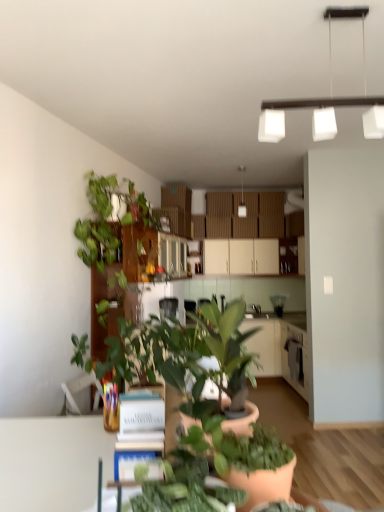
Question: Is green matte plant at center, which is the 2th houseplant from front to back, directly adjacent to white matte cabinet at center?

Choices:
 (A) yes
 (B) no

Answer: (B)

Question: Is green matte plant at center, which is the 2th houseplant from front to back, outside white matte cabinet at center?

Choices:
 (A) no
 (B) yes

Answer: (B)

Question: Considering the relative positions of green matte plant at center, arranged as the second houseplant when viewed from the back, and white matte cabinet at center in the image provided, is green matte plant at center, arranged as the second houseplant when viewed from the back, in front of white matte cabinet at center?

Choices:
 (A) no
 (B) yes

Answer: (B)

Question: From a real-world perspective, is green matte plant at center, which ranks as the second houseplant in left-to-right order, physically above white matte cabinet at center?

Choices:
 (A) yes
 (B) no

Answer: (B)

Question: Considering the relative sizes of green matte plant at center, which ranks as the second houseplant in left-to-right order, and white matte cabinet at center in the image provided, is green matte plant at center, which ranks as the second houseplant in left-to-right order, shorter than white matte cabinet at center?

Choices:
 (A) yes
 (B) no

Answer: (A)

Question: Can you confirm if green matte plant at center, arranged as the second houseplant when viewed from the back, is smaller than white matte cabinet at center?

Choices:
 (A) no
 (B) yes

Answer: (B)

Question: Is white matte book at center at the right side of green matte plant at center, positioned as the 3th houseplant in left-to-right order?

Choices:
 (A) no
 (B) yes

Answer: (A)

Question: Does white matte book at center contain green matte plant at center, positioned as the 3th houseplant in left-to-right order?

Choices:
 (A) no
 (B) yes

Answer: (A)

Question: Does white matte book at center have a greater width compared to green matte plant at center, the 3th houseplant when ordered from back to front?

Choices:
 (A) yes
 (B) no

Answer: (A)

Question: Does white matte book at center have a larger size compared to green matte plant at center, positioned as the 3th houseplant in left-to-right order?

Choices:
 (A) yes
 (B) no

Answer: (A)

Question: Is white matte book at center far from green matte plant at center, which is counted as the 1th houseplant, starting from the front?

Choices:
 (A) yes
 (B) no

Answer: (B)

Question: Is white matte book at center placed right next to green matte plant at center, which is the 1th houseplant from right to left?

Choices:
 (A) no
 (B) yes

Answer: (A)

Question: Could you tell me if green matte plant at center, the second houseplant viewed from the right, is turned towards green matte plant at center, which is the 1th houseplant from right to left?

Choices:
 (A) no
 (B) yes

Answer: (A)